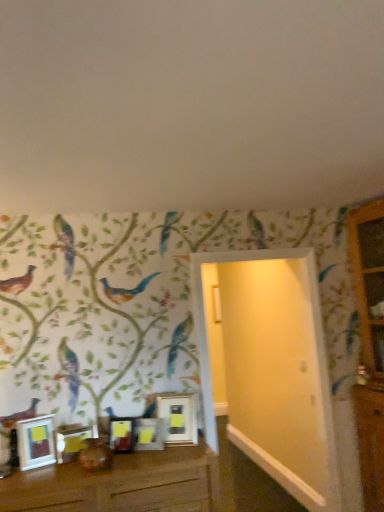
Question: From a real-world perspective, does matte silver picture frame at lower left, which appears as the fourth picture frame when viewed from the right, sit lower than metallic silver picture frame at center, the 1th picture frame viewed from the right?

Choices:
 (A) no
 (B) yes

Answer: (B)

Question: Is matte silver picture frame at lower left, which ranks as the second picture frame in left-to-right order, facing towards metallic silver picture frame at center, the 1th picture frame viewed from the right?

Choices:
 (A) no
 (B) yes

Answer: (A)

Question: Is matte silver picture frame at lower left, which appears as the fourth picture frame when viewed from the right, wider than metallic silver picture frame at center, the fifth picture frame when ordered from left to right?

Choices:
 (A) no
 (B) yes

Answer: (A)

Question: Is matte silver picture frame at lower left, which appears as the fourth picture frame when viewed from the right, smaller than metallic silver picture frame at center, the fifth picture frame when ordered from left to right?

Choices:
 (A) no
 (B) yes

Answer: (B)

Question: Are matte silver picture frame at lower left, which ranks as the second picture frame in left-to-right order, and metallic silver picture frame at center, the fifth picture frame when ordered from left to right, located far from each other?

Choices:
 (A) no
 (B) yes

Answer: (A)

Question: Do you think wooden dresser at right is within white glossy picture frame at lower left, the 1th picture frame positioned from the left, or outside of it?

Choices:
 (A) outside
 (B) inside

Answer: (A)

Question: Is wooden dresser at right wider or thinner than white glossy picture frame at lower left, acting as the 5th picture frame starting from the right?

Choices:
 (A) wide
 (B) thin

Answer: (A)

Question: From a real-world perspective, is wooden dresser at right above or below white glossy picture frame at lower left, the 1th picture frame positioned from the left?

Choices:
 (A) above
 (B) below

Answer: (A)

Question: Is wooden dresser at right bigger or smaller than white glossy picture frame at lower left, acting as the 5th picture frame starting from the right?

Choices:
 (A) small
 (B) big

Answer: (B)

Question: Considering the positions of matte silver picture frame at center, which is the 3th picture frame in right-to-left order, and brown wooden table at lower center in the image, is matte silver picture frame at center, which is the 3th picture frame in right-to-left order, bigger or smaller than brown wooden table at lower center?

Choices:
 (A) small
 (B) big

Answer: (A)

Question: Would you say matte silver picture frame at center, arranged as the 3th picture frame when viewed from the left, is inside or outside brown wooden table at lower center?

Choices:
 (A) outside
 (B) inside

Answer: (A)

Question: From the image's perspective, is matte silver picture frame at center, which is the 3th picture frame in right-to-left order, located above or below brown wooden table at lower center?

Choices:
 (A) above
 (B) below

Answer: (A)

Question: Does point (125, 434) appear closer or farther from the camera than point (132, 460)?

Choices:
 (A) farther
 (B) closer

Answer: (A)

Question: Considering the positions of metallic silver frame at center, which ranks as the 2th picture frame in right-to-left order, and brown wooden table at lower center in the image, is metallic silver frame at center, which ranks as the 2th picture frame in right-to-left order, wider or thinner than brown wooden table at lower center?

Choices:
 (A) wide
 (B) thin

Answer: (B)

Question: Is point (140, 435) closer or farther from the camera than point (31, 486)?

Choices:
 (A) closer
 (B) farther

Answer: (B)